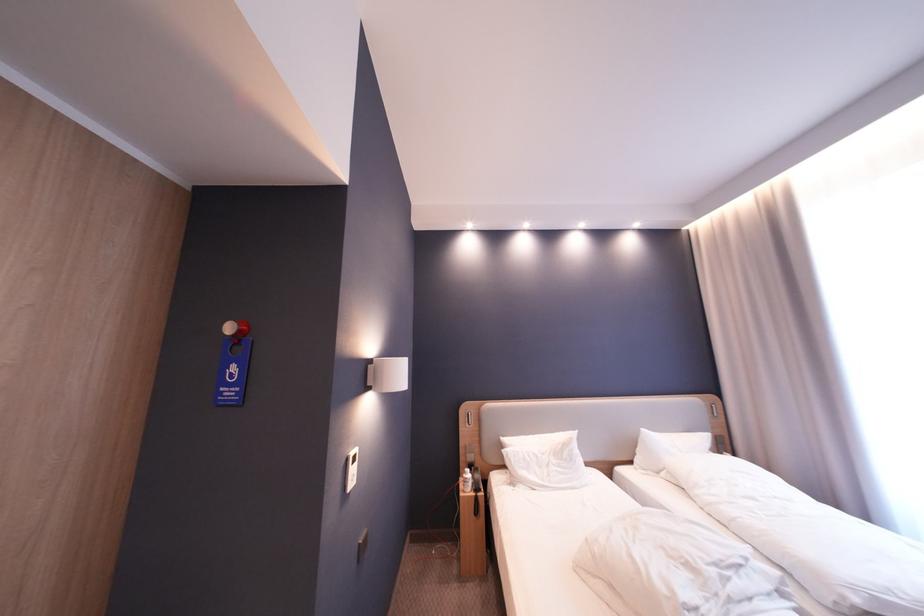
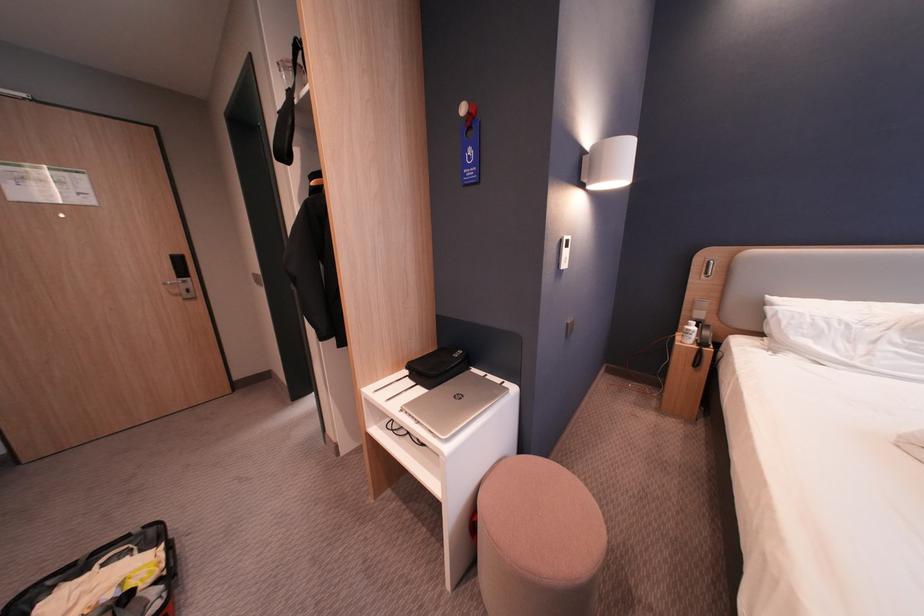
Locate, in the second image, the point that corresponds to [471,479] in the first image.

(688, 334)